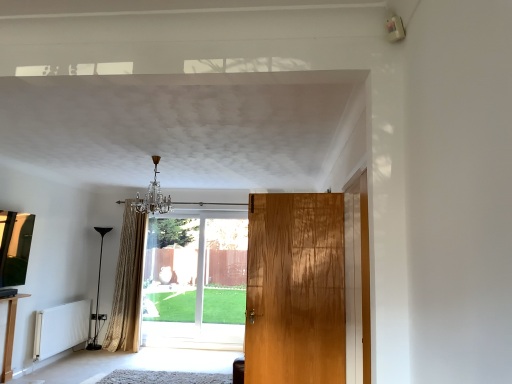
In order to click on free point above crystal glass chandelier at upper center (from a real-world perspective) in this screenshot , I will do `click(152, 152)`.